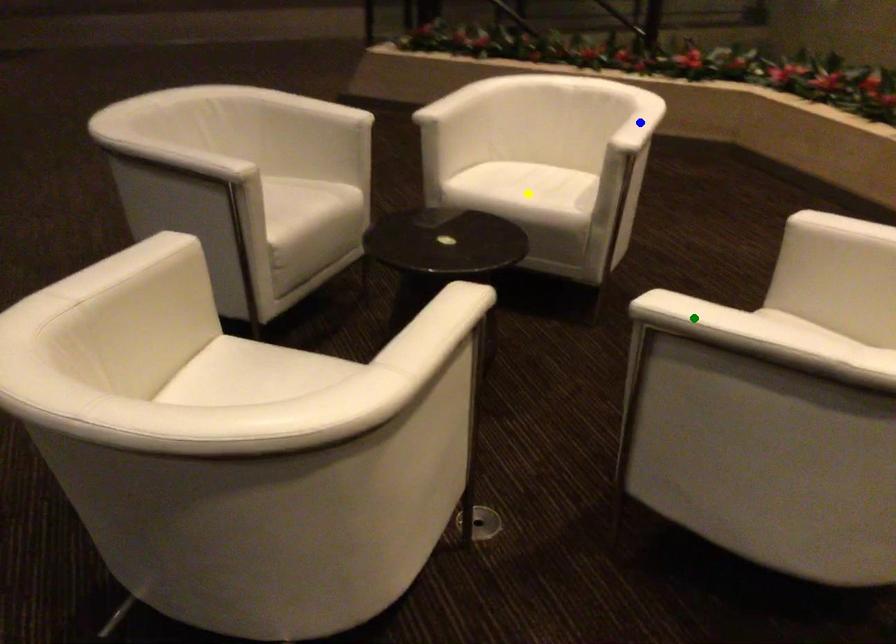
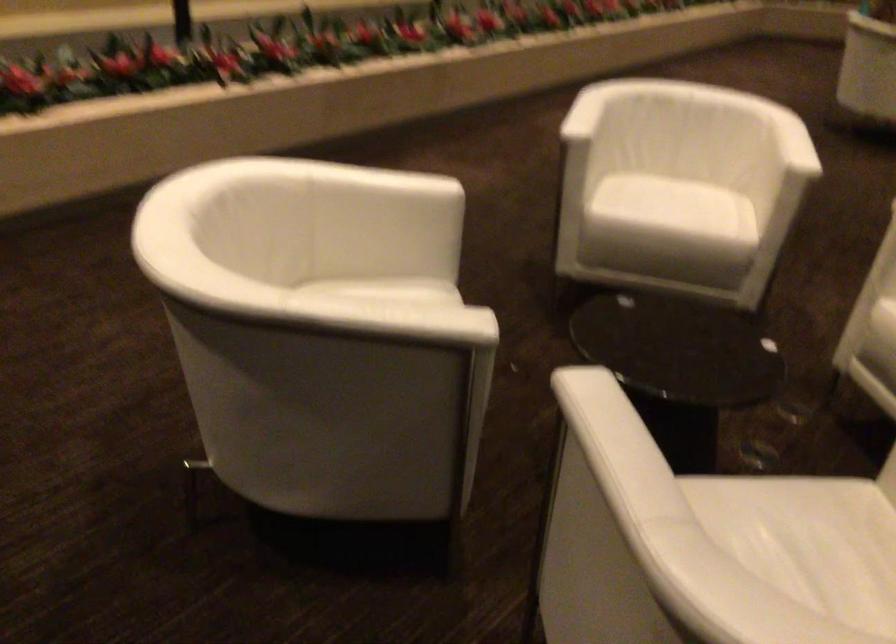
I am providing you with two images of the same scene from different viewpoints. Three points are marked in image1. Which point corresponds to a part or object that is occluded in image2?In image1, three points are marked. Which of them correspond to a part or object that is occluded in image2?Among the three points shown in image1, which one corresponds to a part or object that is no longer visible due to occlusion in image2?

yellow point, blue point, green point cannot be seen in image2.